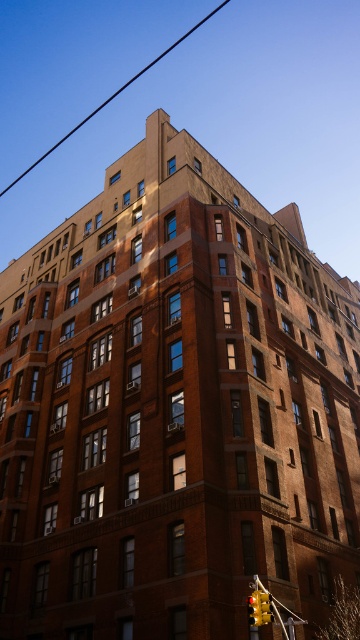
You are a delivery drone approaching the building. You need to fly between the metallic wire at upper center and the yellow matte traffic light at lower right. Which direction should you turn to avoid hitting them?

The metallic wire at upper center is to the left of the yellow matte traffic light at lower right. To avoid hitting them, you should turn to the right to navigate around the yellow matte traffic light at lower right and the metallic wire at upper center.

You are standing in front of a tall brick building and notice a metallic wire at upper center. Given that the wire is 1508.64 feet away from you, would you be able to touch it without climbing any stairs or using equipment?

The metallic wire at upper center is 1508.64 feet away from the camera, which is an extremely long distance. Since you cannot physically reach that far without assistance, you would not be able to touch it without climbing stairs or using equipment.

You are a delivery drone that needs to fly from the metallic wire at upper center to the yellow matte traffic light at lower right. Can you safely descend vertically without hitting any obstacles?

The metallic wire at upper center is positioned over the yellow matte traffic light at lower right, so there are no obstacles between them. The drone can safely descend vertically.